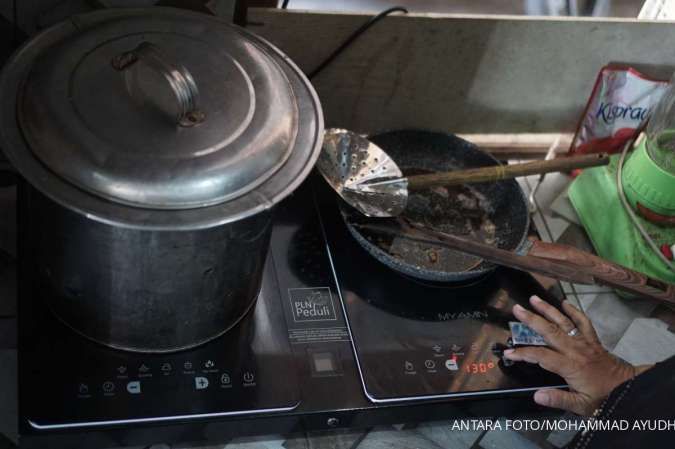
Find the location of `utensil`. utensil is located at coordinates (433, 176), (470, 246).